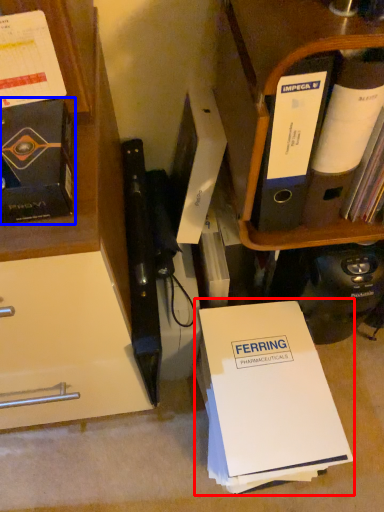
Question: Which object appears farthest to the camera in this image, paperback book (highlighted by a red box) or book (highlighted by a blue box)?

Choices:
 (A) paperback book
 (B) book

Answer: (A)